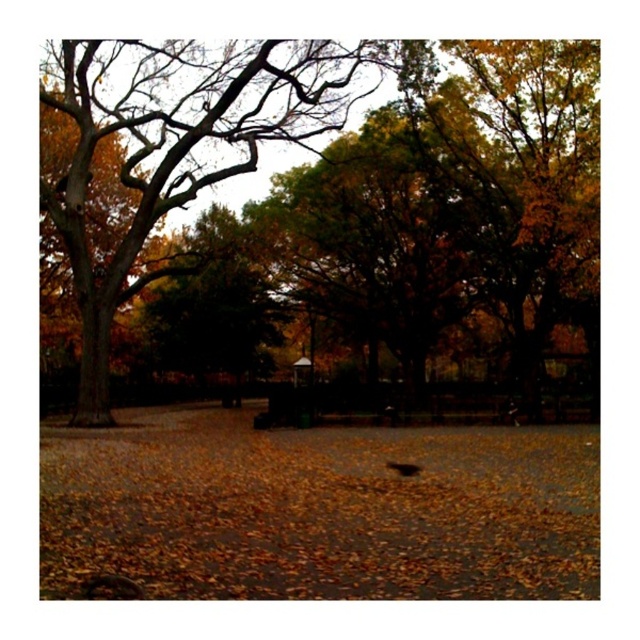
Question: Which of the following is the farthest from the observer?

Choices:
 (A) (328, 502)
 (B) (360, 42)

Answer: (B)

Question: Is brown leaf litter at center below golden textured tree at left?

Choices:
 (A) no
 (B) yes

Answer: (B)

Question: Does brown leaf litter at center appear on the left side of golden textured tree at left?

Choices:
 (A) no
 (B) yes

Answer: (A)

Question: Does brown leaf litter at center appear on the right side of golden textured tree at left?

Choices:
 (A) no
 (B) yes

Answer: (B)